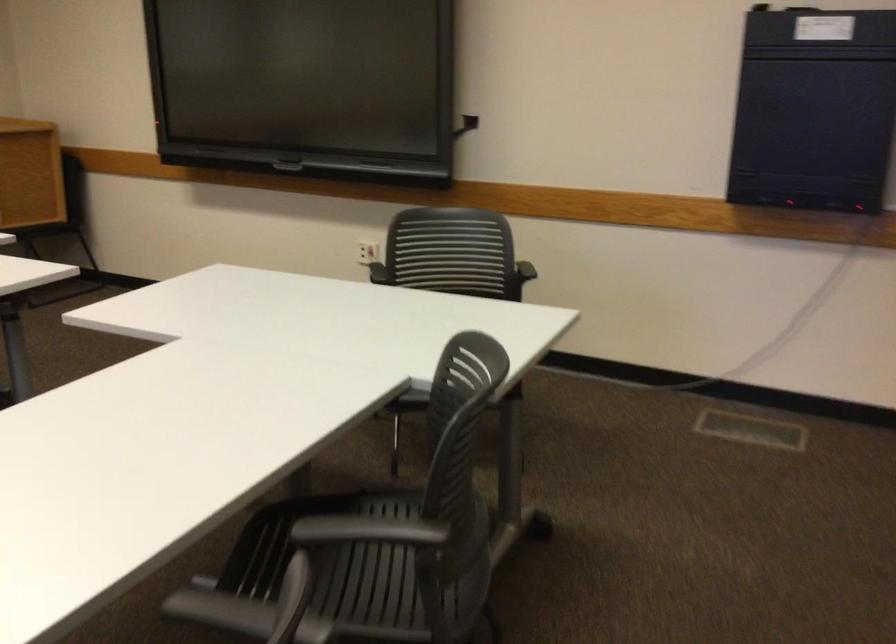
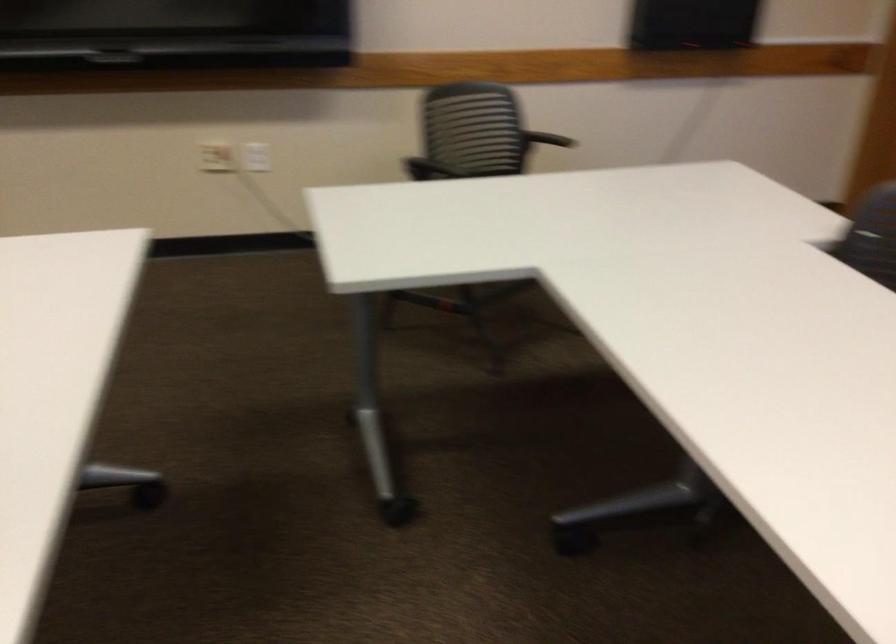
Find the pixel in the second image that matches (416,248) in the first image.

(216, 156)